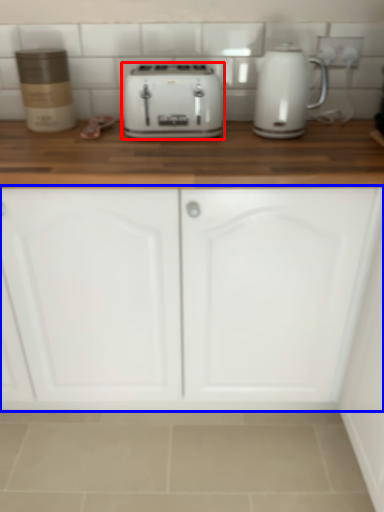
Question: Which object appears closest to the camera in this image, toaster (highlighted by a red box) or cabinetry (highlighted by a blue box)?

Choices:
 (A) toaster
 (B) cabinetry

Answer: (B)